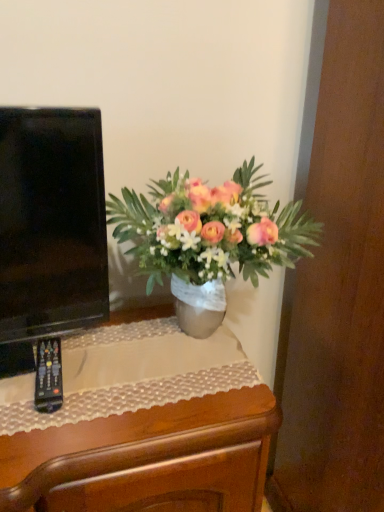
This screenshot has height=512, width=384. I want to click on wooden desk at center, so click(x=144, y=457).

Locate an element on the screen. This screenshot has width=384, height=512. metallic silver vase at center is located at coordinates (209, 239).

Measure the distance between black plastic remote at lower left and camera.

black plastic remote at lower left and camera are 72.90 centimeters apart.

Locate an element on the screen. The width and height of the screenshot is (384, 512). wooden desk at center is located at coordinates (144, 457).

Considering the points (60, 353) and (189, 204), which point is behind, point (60, 353) or point (189, 204)?

The point (60, 353) is farther.

Which is behind, black plastic remote at lower left or metallic silver vase at center?

black plastic remote at lower left.

Considering the sizes of objects black plastic remote at lower left and metallic silver vase at center in the image provided, who is shorter, black plastic remote at lower left or metallic silver vase at center?

black plastic remote at lower left.

From the image's perspective, which is below, metallic silver vase at center or black plastic remote at lower left?

black plastic remote at lower left appears lower in the image.

Considering their positions, is metallic silver vase at center located in front of or behind black plastic remote at lower left?

metallic silver vase at center is positioned closer to the viewer than black plastic remote at lower left.

Which is more to the right, metallic silver vase at center or black plastic remote at lower left?

Positioned to the right is metallic silver vase at center.

Looking at this image, are metallic silver vase at center and black plastic remote at lower left beside each other?

metallic silver vase at center and black plastic remote at lower left are not in contact.

Considering the sizes of wooden desk at center and black plastic remote at lower left in the image, is wooden desk at center bigger or smaller than black plastic remote at lower left?

In the image, wooden desk at center appears to be larger than black plastic remote at lower left.

From the image's perspective, which object appears higher, wooden desk at center or black plastic remote at lower left?

black plastic remote at lower left.

From a real-world perspective, is wooden desk at center physically below black plastic remote at lower left?

Yes, from a real-world perspective, wooden desk at center is below black plastic remote at lower left.

Image resolution: width=384 pixels, height=512 pixels. Find the location of `desk located underneath the black plastic remote at lower left (from a real-world perspective)`. desk located underneath the black plastic remote at lower left (from a real-world perspective) is located at coordinates (144, 457).

Is metallic silver vase at center a part of wooden desk at center?

Definitely not — metallic silver vase at center is not inside wooden desk at center.

Could you tell me if wooden desk at center is facing metallic silver vase at center?

No, wooden desk at center is not aimed at metallic silver vase at center.

In order to click on desk that is under the metallic silver vase at center (from a real-world perspective) in this screenshot , I will do click(144, 457).

Does wooden desk at center have a greater width compared to metallic silver vase at center?

Yes.

From the image's perspective, which is below, black plastic remote at lower left or wooden desk at center?

wooden desk at center is shown below in the image.

Considering the positions of points (57, 378) and (199, 415), is point (57, 378) closer to camera compared to point (199, 415)?

No, (57, 378) is behind (199, 415).

Which is behind, black plastic remote at lower left or wooden desk at center?

black plastic remote at lower left.

Based on the photo, how distant is black plastic remote at lower left from wooden desk at center?

A distance of 8.71 inches exists between black plastic remote at lower left and wooden desk at center.

In the scene shown: Between metallic silver vase at center and wooden desk at center, which one has more height?

metallic silver vase at center is taller.

From the image's perspective, which one is positioned higher, metallic silver vase at center or wooden desk at center?

metallic silver vase at center appears higher in the image.

Is metallic silver vase at center to the right of wooden desk at center from the viewer's perspective?

Yes, metallic silver vase at center is to the right of wooden desk at center.

Does metallic silver vase at center touch wooden desk at center?

No, metallic silver vase at center is not touching wooden desk at center.

Locate an element on the screen. houseplant in front of the black plastic remote at lower left is located at coordinates (209, 239).

Where is `remote control on the left side of metallic silver vase at center`? This screenshot has width=384, height=512. remote control on the left side of metallic silver vase at center is located at coordinates (48, 376).

Based on their spatial positions, is wooden desk at center or metallic silver vase at center further from black plastic remote at lower left?

metallic silver vase at center lies further to black plastic remote at lower left than the other object.

Looking at the image, which one is located closer to metallic silver vase at center, wooden desk at center or black plastic remote at lower left?

wooden desk at center is positioned closer to the anchor metallic silver vase at center.

Considering their positions, is metallic silver vase at center positioned further to black plastic remote at lower left than wooden desk at center?

metallic silver vase at center lies further to black plastic remote at lower left than the other object.

Considering their positions, is metallic silver vase at center positioned further to wooden desk at center than black plastic remote at lower left?

metallic silver vase at center is further to wooden desk at center.

Looking at the image, which one is located further to metallic silver vase at center, black plastic remote at lower left or wooden desk at center?

The object further to metallic silver vase at center is black plastic remote at lower left.

Which object lies further to the anchor point wooden desk at center, black plastic remote at lower left or metallic silver vase at center?

The object further to wooden desk at center is metallic silver vase at center.

Identify the location of remote control between metallic silver vase at center and wooden desk at center in the vertical direction. (48, 376).